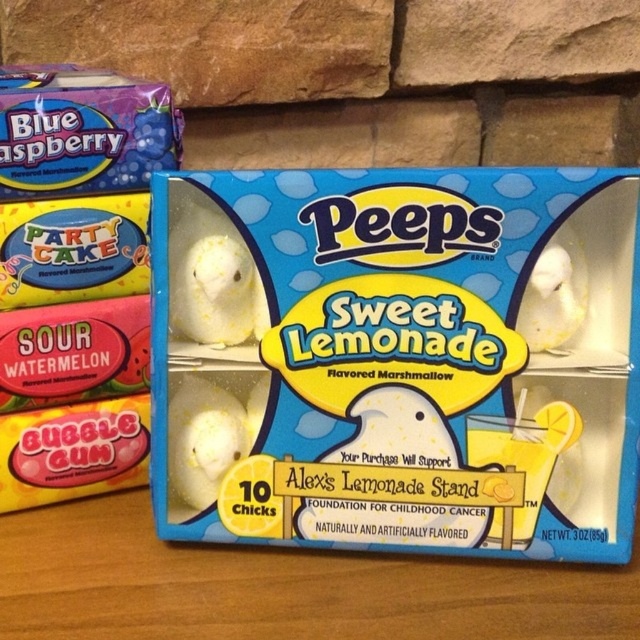
You are a photographer trying to capture a closeup shot of the white matte marshmallow chicks at center. If your camera requires the subject to be within 50 centimeters for optimal focus, will you need to move closer or farther away?

The white matte marshmallow chicks at center are 68.31 centimeters away from the camera, which is beyond the 50 centimeter requirement. Therefore, you need to move closer to achieve optimal focus.